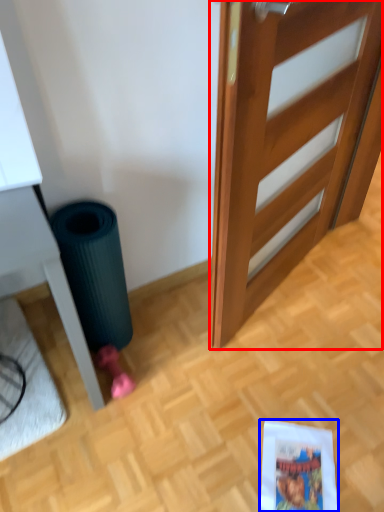
Question: Which object appears closest to the camera in this image, door (highlighted by a red box) or comic book (highlighted by a blue box)?

Choices:
 (A) door
 (B) comic book

Answer: (A)